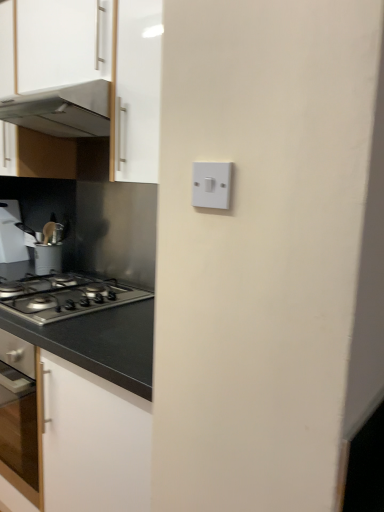
Question: In terms of height, does white plastic light switch at center look taller or shorter compared to white glossy cabinet at upper left?

Choices:
 (A) tall
 (B) short

Answer: (B)

Question: Is white plastic light switch at center spatially inside white glossy cabinet at upper left, or outside of it?

Choices:
 (A) inside
 (B) outside

Answer: (B)

Question: Estimate the real-world distances between objects in this image. Which object is farther from the satin silver gas stove at lower left?

Choices:
 (A) white glossy cabinet at upper left
 (B) metallic stainless steel range hood at upper left
 (C) brushed metal utensil holder at left
 (D) white plastic light switch at center

Answer: (D)

Question: Considering the real-world distances, which object is farthest from the satin silver gas stove at lower left?

Choices:
 (A) white plastic light switch at center
 (B) white glossy cabinet at upper left
 (C) metallic stainless steel range hood at upper left
 (D) brushed metal utensil holder at left

Answer: (A)